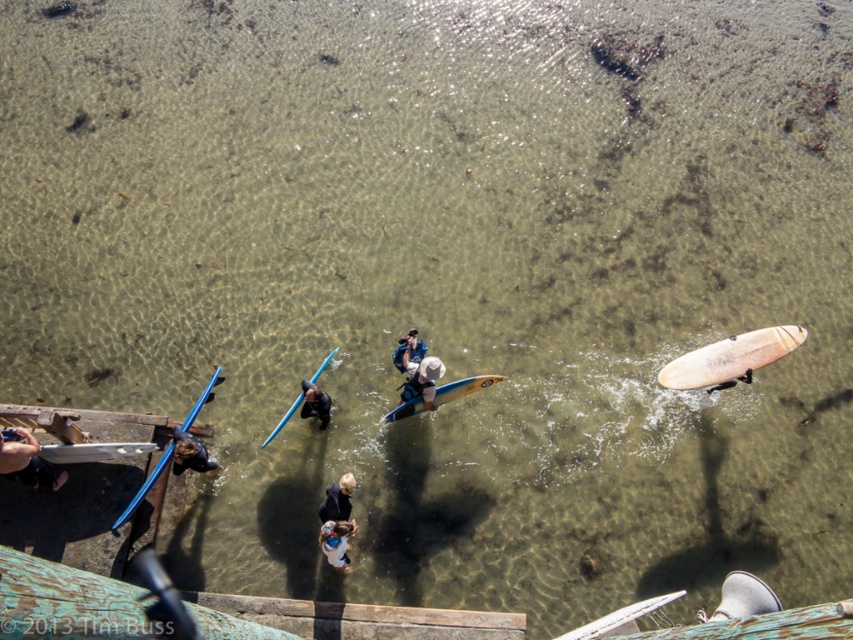
How much distance is there between blue matte surfboard at lower left and dark blue fabric at center?

blue matte surfboard at lower left and dark blue fabric at center are 7.18 feet apart.

Does blue matte surfboard at lower left appear over dark blue fabric at center?

Correct, blue matte surfboard at lower left is located above dark blue fabric at center.

Which is behind, point (184, 428) or point (334, 509)?

The point (184, 428) is more distant.

The width and height of the screenshot is (853, 640). Identify the location of blue matte surfboard at lower left. (144, 486).

Which of these two, matte black surfboard at lower left or blue glossy surfboard at center, stands shorter?

blue glossy surfboard at center is shorter.

Can you confirm if matte black surfboard at lower left is positioned above blue glossy surfboard at center?

No.

Between point (41, 458) and point (286, 419), which one is positioned behind?

The point (286, 419) is behind.

Locate an element on the screen. matte black surfboard at lower left is located at coordinates (28, 461).

Is white glossy surfboard at lower right positioned at the back of blue glossy surfboard at center?

No.

Identify the location of white glossy surfboard at lower right. The image size is (853, 640). (619, 618).